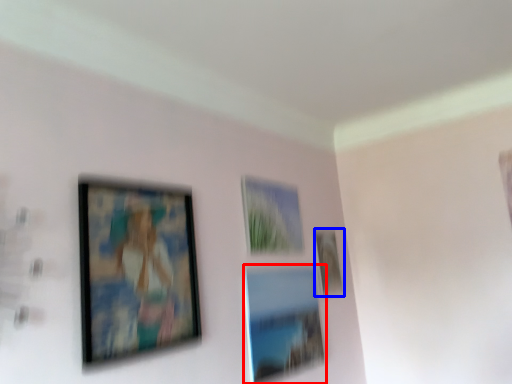
Question: Which of the following is the farthest to the observer, picture frame (highlighted by a red box) or picture frame (highlighted by a blue box)?

Choices:
 (A) picture frame
 (B) picture frame

Answer: (B)